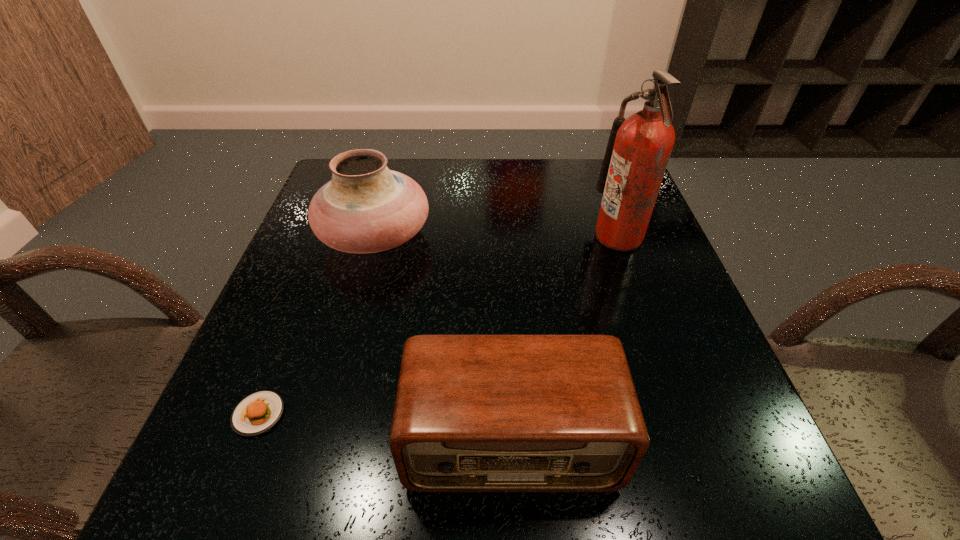
This screenshot has width=960, height=540. Identify the location of vacant area at the far right corner of the desktop. (596, 183).

What are the coordinates of `free space at the near right corner of the desktop` in the screenshot? It's located at (712, 484).

This screenshot has width=960, height=540. I want to click on unoccupied area between the radio receiver and the shortest object, so click(385, 428).

Image resolution: width=960 pixels, height=540 pixels. I want to click on vacant area that lies between the second shortest object and the food, so click(x=385, y=428).

You are a GUI agent. You are given a task and a screenshot of the screen. Output one action in this format:
    pyautogui.click(x=<x>, y=<y>)
    Task: Click on the free space between the food and the fire extinguisher
    
    Given the screenshot: What is the action you would take?
    pyautogui.click(x=439, y=325)

Where is `free space between the fire extinguisher and the pottery`? free space between the fire extinguisher and the pottery is located at coordinates click(497, 237).

Locate an element on the screen. blank region between the second tallest object and the tallest object is located at coordinates (497, 237).

This screenshot has height=540, width=960. What are the coordinates of `free space between the pottery and the shortest object` in the screenshot? It's located at (317, 326).

Select which object appears as the third closest to the second object from right to left. Please provide its 2D coordinates. Your answer should be formatted as a tuple, i.e. [(x, y)], where the tuple contains the x and y coordinates of a point satisfying the conditions above.

[(638, 150)]

Identify which object is the closest to the radio receiver. Please provide its 2D coordinates. Your answer should be formatted as a tuple, i.e. [(x, y)], where the tuple contains the x and y coordinates of a point satisfying the conditions above.

[(258, 412)]